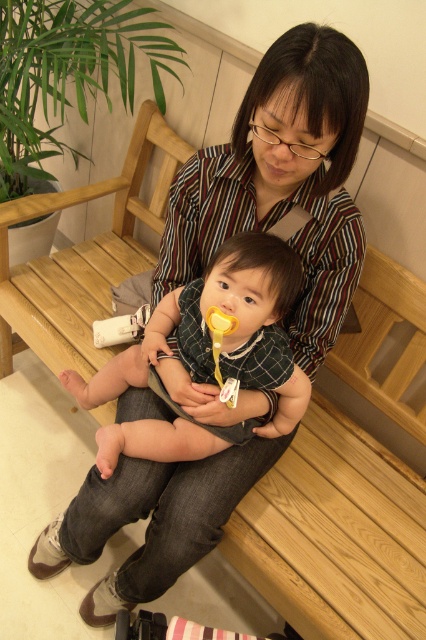
What are the coordinates of the soft yellow pacifier at center?

The soft yellow pacifier at center is located at point (224, 337).

You are a parent who wants to give either the soft yellow pacifier at center or the yellow rubber spoon at center to your baby. Which one is wider?

The soft yellow pacifier at center is wider than the yellow rubber spoon at center.

You are a photographer aiming to capture a closeup shot of the soft yellow pacifier at center. The camera you are using has a minimum focusing distance of 40 inches. Based on the scene description, can you successfully take the photo without moving the pacifier?

The soft yellow pacifier at center and camera are 38.91 inches apart, which is less than the camera minimum focusing distance of 40 inches. Therefore, you cannot take the photo without moving the pacifier closer.